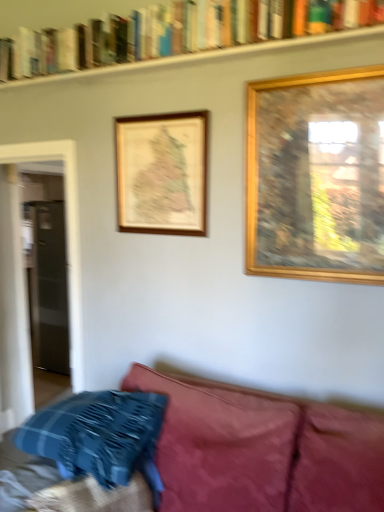
Question: Does wooden map at upper center, which is counted as the first picture frame, starting from the left, have a lesser width compared to clear glass door at left?

Choices:
 (A) yes
 (B) no

Answer: (B)

Question: From the image's perspective, is wooden map at upper center, the second picture frame viewed from the front, located above clear glass door at left?

Choices:
 (A) no
 (B) yes

Answer: (B)

Question: From the image's perspective, does wooden map at upper center, which appears as the 2th picture frame when viewed from the right, appear lower than clear glass door at left?

Choices:
 (A) yes
 (B) no

Answer: (B)

Question: From a real-world perspective, is wooden map at upper center, the 1th picture frame in the back-to-front sequence, on top of clear glass door at left?

Choices:
 (A) yes
 (B) no

Answer: (A)

Question: Does wooden map at upper center, which is counted as the first picture frame, starting from the left, lie in front of clear glass door at left?

Choices:
 (A) yes
 (B) no

Answer: (A)

Question: Is point (54, 209) positioned closer to the camera than point (331, 96)?

Choices:
 (A) closer
 (B) farther

Answer: (B)

Question: Choose the correct answer: Is clear glass door at left inside gold wooden picture frame at upper right, which is the 1th picture frame in right-to-left order, or outside it?

Choices:
 (A) inside
 (B) outside

Answer: (B)

Question: In the image, is clear glass door at left positioned in front of or behind gold wooden picture frame at upper right, the 2th picture frame from the left?

Choices:
 (A) front
 (B) behind

Answer: (B)

Question: Considering the positions of clear glass door at left and gold wooden picture frame at upper right, arranged as the 2th picture frame when viewed from the back, in the image, is clear glass door at left wider or thinner than gold wooden picture frame at upper right, arranged as the 2th picture frame when viewed from the back,?

Choices:
 (A) thin
 (B) wide

Answer: (A)

Question: Is wooden map at upper center, which is counted as the first picture frame, starting from the left, in front of or behind blue plaid pillow at lower left in the image?

Choices:
 (A) behind
 (B) front

Answer: (A)

Question: From the image's perspective, relative to blue plaid pillow at lower left, is wooden map at upper center, which appears as the 2th picture frame when viewed from the right, above or below?

Choices:
 (A) below
 (B) above

Answer: (B)

Question: Is wooden map at upper center, the 1th picture frame in the back-to-front sequence, spatially inside blue plaid pillow at lower left, or outside of it?

Choices:
 (A) outside
 (B) inside

Answer: (A)

Question: Is wooden map at upper center, the 1th picture frame in the back-to-front sequence, wider or thinner than blue plaid pillow at lower left?

Choices:
 (A) wide
 (B) thin

Answer: (B)

Question: Is wooden map at upper center, the second picture frame viewed from the front, spatially inside gold wooden picture frame at upper right, acting as the 1th picture frame starting from the front, or outside of it?

Choices:
 (A) inside
 (B) outside

Answer: (B)

Question: From a real-world perspective, is wooden map at upper center, the second picture frame viewed from the front, physically located above or below gold wooden picture frame at upper right, arranged as the 2th picture frame when viewed from the back?

Choices:
 (A) above
 (B) below

Answer: (A)